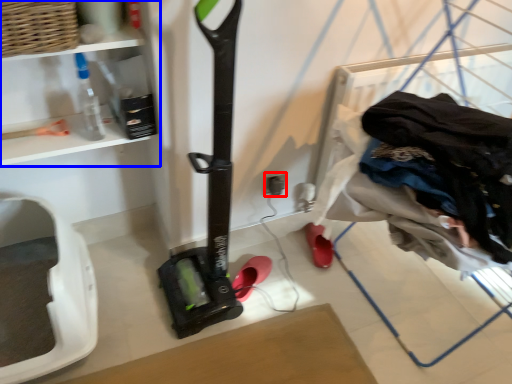
Question: Which object is closer to the camera taking this photo, electric outlet (highlighted by a red box) or shelf (highlighted by a blue box)?

Choices:
 (A) electric outlet
 (B) shelf

Answer: (B)